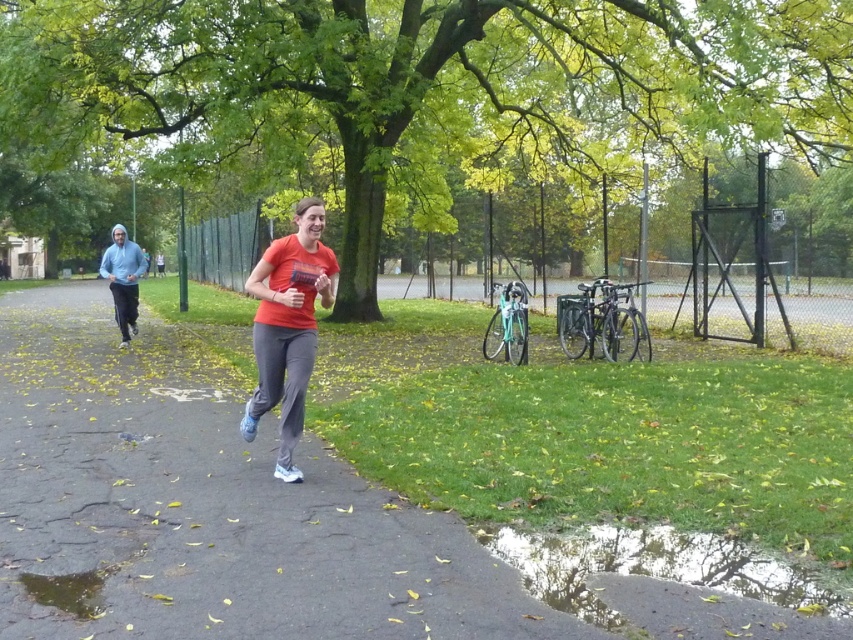
You are standing at the center of the paved path in the park. Which direction should you walk to reach the green leafy tree at center?

The green leafy tree at center is located at coordinates point [427,81], so you should walk towards the center of the image to reach it.

You are a photographer standing at the edge of the path. You want to take a photo of the light blue hoodie at left without the green leafy tree at center blocking it. What should you do?

Move to the right side of the path so that the green leafy tree at center is no longer in front of the light blue hoodie at left, allowing you to capture the light blue hoodie at left without obstruction.

You are standing at the edge of the path in the park scene. You see the green leafy tree at center and the light blue hoodie at left. Which object is positioned to the right of the other?

The green leafy tree at center is positioned to the right of the light blue hoodie at left.